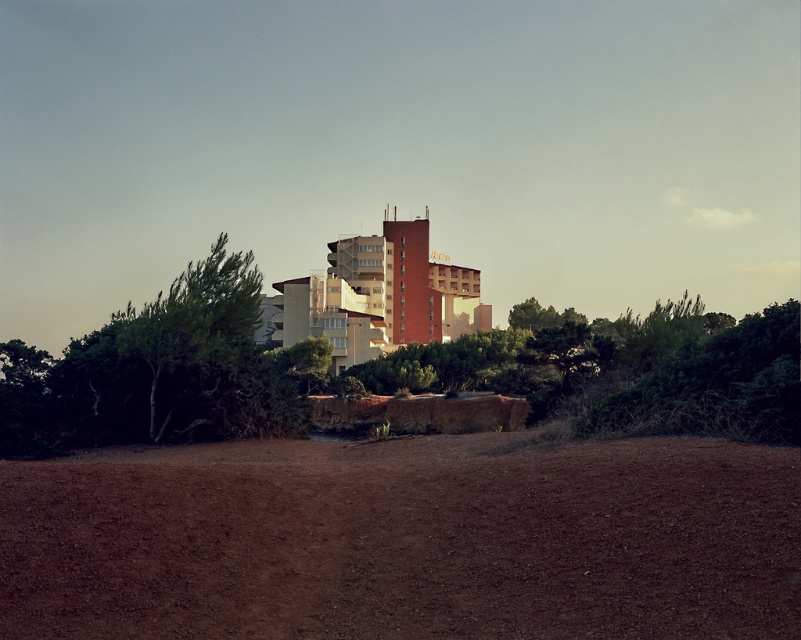
Is brown soil at lower center further to the viewer compared to green leafy tree at left?

No.

Does brown soil at lower center appear over green leafy tree at left?

No.

Between point (348, 608) and point (268, 419), which one is positioned behind?

Point (268, 419)

Where is `brown soil at lower center`? The image size is (801, 640). brown soil at lower center is located at coordinates (405, 540).